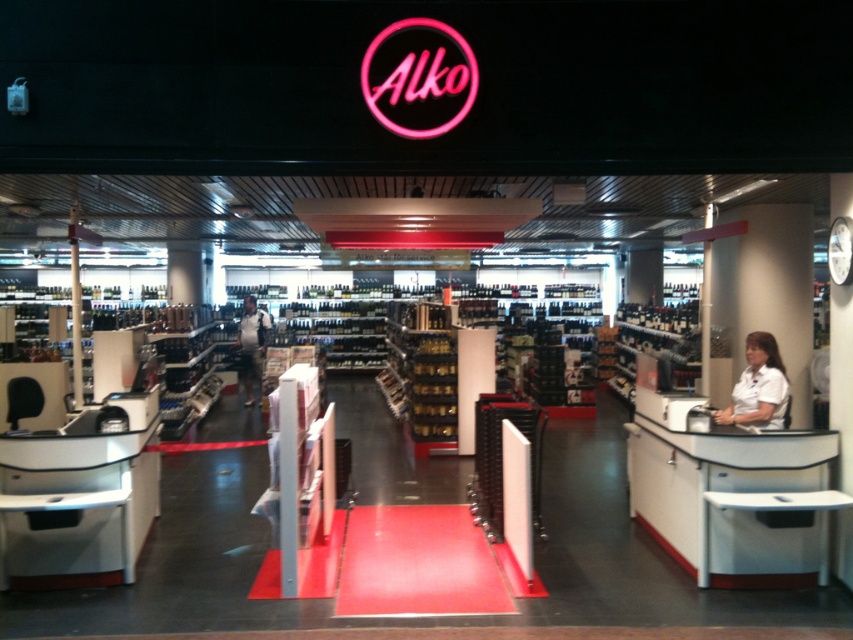
You are a customer in the Alko store and want to find a specific bottle of wine. You see a white smooth shirt at right and a dark blue jeans at center. Which object is positioned more to the right side of the store?

The white smooth shirt at right is positioned more to the right than the dark blue jeans at center because the white smooth shirt at right is to the right of dark blue jeans at center.

You are a customer in an Alko store and you want to find a pair of jeans that can fit into your backpack. You see the white smooth shirt at right and the dark blue jeans at center. Which item is smaller in size and more likely to fit into your backpack?

The white smooth shirt at right has a smaller size compared to dark blue jeans at center, so it is more likely to fit into your backpack.